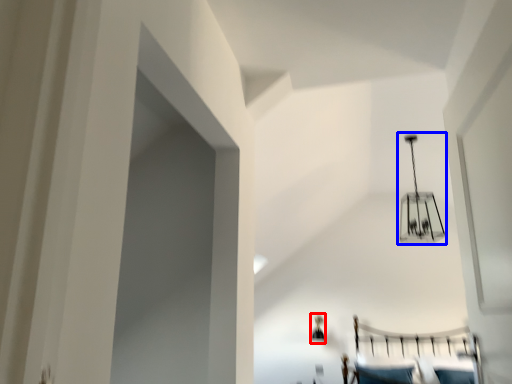
Question: Which object is further to the camera taking this photo, lamp (highlighted by a red box) or lamp (highlighted by a blue box)?

Choices:
 (A) lamp
 (B) lamp

Answer: (A)